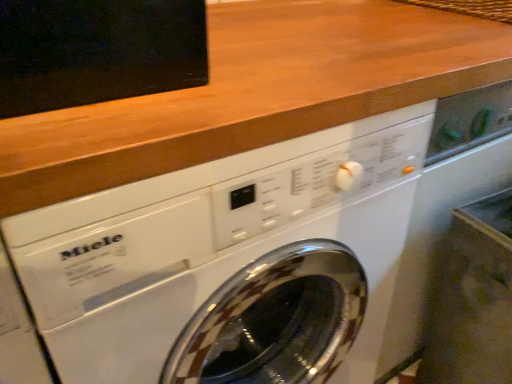
Identify the location of wooden at upper center. The image size is (512, 384). (255, 93).

In order to face wooden at upper center, should I rotate leftwards or rightwards?

Rotate your view right by about 10.992°.

What is the approximate height of wooden at upper center?

It is 1.85 inches.

Describe the element at coordinates (255, 93) in the screenshot. I see `wooden at upper center` at that location.

Identify the location of white glossy washing machine at center. Image resolution: width=512 pixels, height=384 pixels. (230, 263).

Describe the element at coordinates (230, 263) in the screenshot. Image resolution: width=512 pixels, height=384 pixels. I see `white glossy washing machine at center` at that location.

The width and height of the screenshot is (512, 384). I want to click on wooden at upper center, so click(x=255, y=93).

Between white glossy washing machine at center and wooden at upper center, which one appears on the left side from the viewer's perspective?

From the viewer's perspective, white glossy washing machine at center appears more on the left side.

Considering their positions, is white glossy washing machine at center located in front of or behind wooden at upper center?

Visually, white glossy washing machine at center is located behind wooden at upper center.

Between point (393, 173) and point (386, 52), which one is positioned behind?

The point (393, 173) is farther from the camera.

From the image's perspective, is white glossy washing machine at center located beneath wooden at upper center?

Yes.

From a real-world perspective, relative to wooden at upper center, is white glossy washing machine at center vertically above or below?

white glossy washing machine at center is situated lower than wooden at upper center in the real world.

Is white glossy washing machine at center wider than wooden at upper center?

Yes.

Looking at this image, considering the relative sizes of white glossy washing machine at center and wooden at upper center in the image provided, is white glossy washing machine at center shorter than wooden at upper center?

No, white glossy washing machine at center is not shorter than wooden at upper center.

Between white glossy washing machine at center and wooden at upper center, which one has smaller size?

wooden at upper center.

Is white glossy washing machine at center outside of wooden at upper center?

Yes, white glossy washing machine at center is outside of wooden at upper center.

Is white glossy washing machine at center positioned far away from wooden at upper center?

No.

Is white glossy washing machine at center facing towards wooden at upper center?

No.

What's the angular difference between white glossy washing machine at center and wooden at upper center's facing directions?

white glossy washing machine at center and wooden at upper center are facing 0.198 degrees away from each other.

How distant is white glossy washing machine at center from wooden at upper center?

The distance of white glossy washing machine at center from wooden at upper center is 8.68 inches.

This screenshot has height=384, width=512. What are the coordinates of `washing machine located behind the wooden at upper center` in the screenshot? It's located at (230, 263).

Does wooden at upper center appear on the left side of white glossy washing machine at center?

Incorrect, wooden at upper center is not on the left side of white glossy washing machine at center.

Which is in front, wooden at upper center or white glossy washing machine at center?

wooden at upper center is in front.

Considering the positions of point (226, 107) and point (56, 300), is point (226, 107) closer or farther from the camera than point (56, 300)?

Point (226, 107) is positioned farther from the camera compared to point (56, 300).

From the image's perspective, would you say wooden at upper center is positioned over white glossy washing machine at center?

Indeed, from the image's perspective, wooden at upper center is shown above white glossy washing machine at center.

Consider the image. From a real-world perspective, who is located higher, wooden at upper center or white glossy washing machine at center?

In real-world perspective, wooden at upper center is above.

From the picture: Considering the relative sizes of wooden at upper center and white glossy washing machine at center in the image provided, is wooden at upper center wider than white glossy washing machine at center?

No.

Considering the sizes of objects wooden at upper center and white glossy washing machine at center in the image provided, who is taller, wooden at upper center or white glossy washing machine at center?

Standing taller between the two is white glossy washing machine at center.

Considering the relative sizes of wooden at upper center and white glossy washing machine at center in the image provided, is wooden at upper center smaller than white glossy washing machine at center?

Yes, wooden at upper center is smaller than white glossy washing machine at center.

Which is correct: wooden at upper center is inside white glossy washing machine at center, or outside of it?

wooden at upper center cannot be found inside white glossy washing machine at center.

Is wooden at upper center touching white glossy washing machine at center?

No.

In the scene shown: Is wooden at upper center aimed at white glossy washing machine at center?

No, wooden at upper center is not facing towards white glossy washing machine at center.

Based on the photo, measure the distance from wooden at upper center to white glossy washing machine at center.

22.05 centimeters.

You are a GUI agent. You are given a task and a screenshot of the screen. Output one action in this format:
    pyautogui.click(x=<x>, y=<y>)
    Task: Click on the counter top located on the right of white glossy washing machine at center
    The height and width of the screenshot is (384, 512).
    Given the screenshot: What is the action you would take?
    pyautogui.click(x=255, y=93)

The height and width of the screenshot is (384, 512). What are the coordinates of `washing machine that appears behind the wooden at upper center` in the screenshot? It's located at (230, 263).

Where is `washing machine on the left of wooden at upper center`? The height and width of the screenshot is (384, 512). washing machine on the left of wooden at upper center is located at coordinates (230, 263).